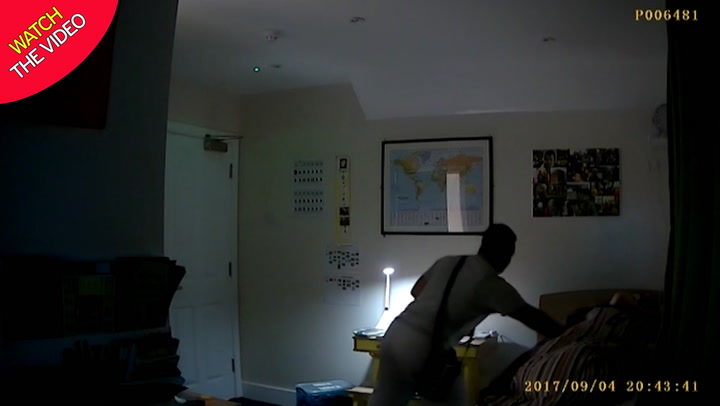
You are a GUI agent. You are given a task and a screenshot of the screen. Output one action in this format:
    pyautogui.click(x=<x>, y=<y>)
    Task: Click on the decorations on wall
    Image resolution: width=720 pixels, height=406 pixels.
    Given the screenshot: What is the action you would take?
    pyautogui.click(x=305, y=192), pyautogui.click(x=348, y=262), pyautogui.click(x=343, y=187), pyautogui.click(x=446, y=175), pyautogui.click(x=580, y=173)